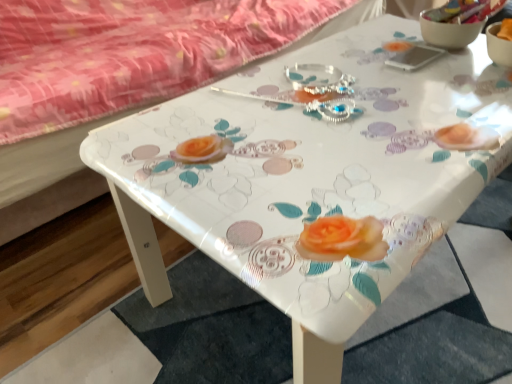
Find the location of a particular element. This screenshot has width=512, height=384. unoccupied space behind white glossy bowl at upper right is located at coordinates (394, 22).